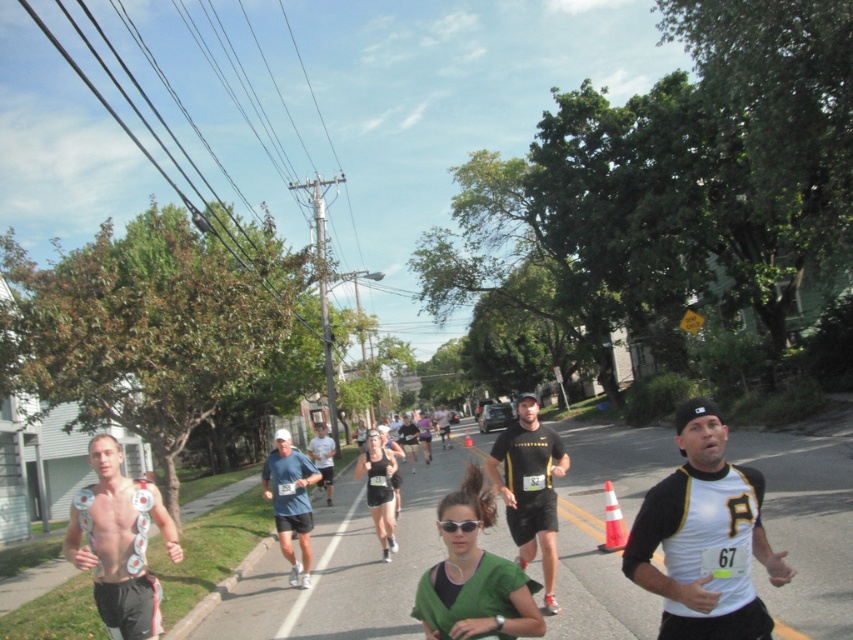
Question: Is white jersey at center to the right of black plastic sunglasses at center from the viewer's perspective?

Choices:
 (A) yes
 (B) no

Answer: (A)

Question: Can you confirm if shiny metallic medals at left is positioned to the left of white cotton shirt at center?

Choices:
 (A) no
 (B) yes

Answer: (A)

Question: Estimate the real-world distances between objects in this image. Which object is farther from the matte black tank top at center?

Choices:
 (A) black matte shirt at center
 (B) shiny metallic medals at left

Answer: (B)

Question: Among these points, which one is farthest from the camera?

Choices:
 (A) (326, 465)
 (B) (506, 513)
 (C) (606, 493)
 (D) (119, 488)

Answer: (A)

Question: Is white jersey at center smaller than matte black tank top at center?

Choices:
 (A) yes
 (B) no

Answer: (B)

Question: Which object is the closest to the orange reflective cone at lower right?

Choices:
 (A) blue fabric shirt at center
 (B) orange traffic cone at center
 (C) black matte shirt at center
 (D) white jersey at center

Answer: (C)